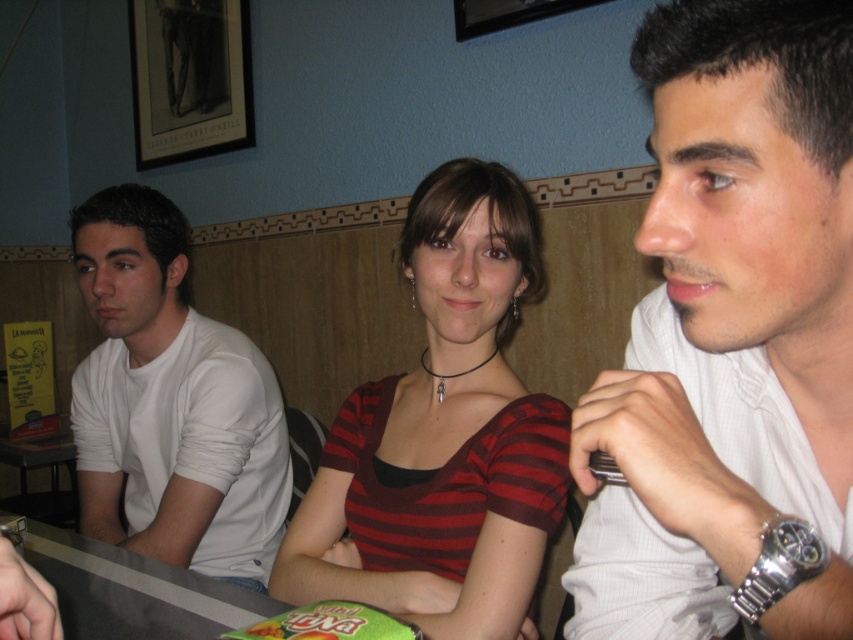
Is white textured shirt at center above striped fabric shirt at center?

Correct, white textured shirt at center is located above striped fabric shirt at center.

From the picture: Can you confirm if white textured shirt at center is taller than striped fabric shirt at center?

No, white textured shirt at center is not taller than striped fabric shirt at center.

Between point (704, 483) and point (486, 244), which one is positioned in front?

Point (704, 483)

Where is `white textured shirt at center`? The width and height of the screenshot is (853, 640). white textured shirt at center is located at coordinates (730, 340).

Is point (697, 548) more distant than point (80, 204)?

No, it is not.

Which is more to the right, white textured shirt at center or white matte shirt at left?

white textured shirt at center

Between point (830, 205) and point (119, 545), which one is positioned in front?

Positioned in front is point (830, 205).

Where is `white textured shirt at center`? This screenshot has width=853, height=640. white textured shirt at center is located at coordinates (730, 340).

What do you see at coordinates (444, 435) in the screenshot? The width and height of the screenshot is (853, 640). I see `striped fabric shirt at center` at bounding box center [444, 435].

You are a GUI agent. You are given a task and a screenshot of the screen. Output one action in this format:
    pyautogui.click(x=<x>, y=<y>)
    Task: Click on the striped fabric shirt at center
    
    Given the screenshot: What is the action you would take?
    pyautogui.click(x=444, y=435)